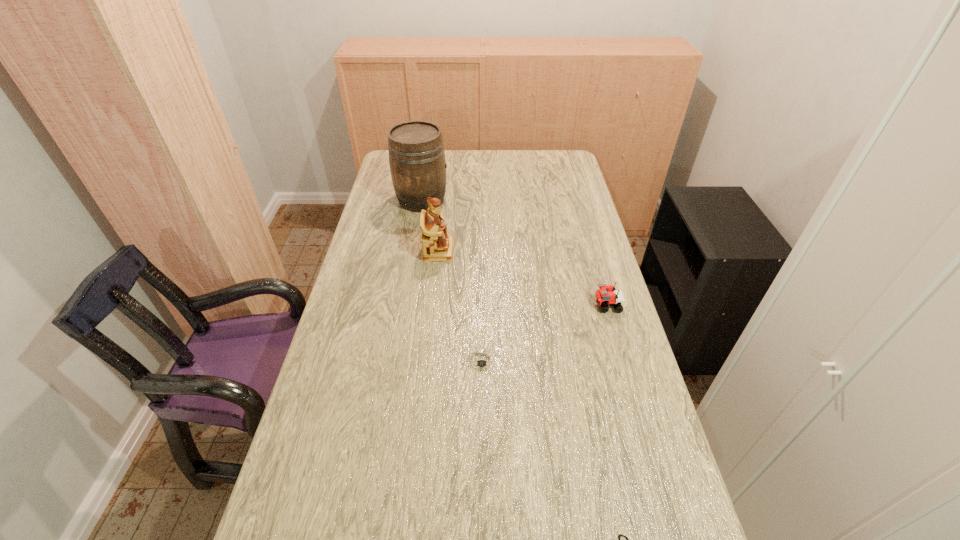
Locate an element on the screen. vacant area situated on the front-facing side of the third tallest object is located at coordinates (521, 306).

At what (x,y) coordinates should I click in order to perform the action: click on vacant space positioned on the front-facing side of the third tallest object. Please return your answer as a coordinate pair (x, y). The image size is (960, 540). Looking at the image, I should click on [521, 306].

You are a GUI agent. You are given a task and a screenshot of the screen. Output one action in this format:
    pyautogui.click(x=<x>, y=<y>)
    Task: Click on the vacant space located 0.250m on the front-facing side of the third tallest object
    The height and width of the screenshot is (540, 960).
    Given the screenshot: What is the action you would take?
    pyautogui.click(x=511, y=306)

The height and width of the screenshot is (540, 960). What are the coordinates of `vacant point located 0.100m on the face of the watch` in the screenshot? It's located at (483, 411).

At what (x,y) coordinates should I click in order to perform the action: click on object that is positioned at the left edge. Please return your answer as a coordinate pair (x, y). Looking at the image, I should click on (416, 153).

Where is `object present at the right edge`? This screenshot has width=960, height=540. object present at the right edge is located at coordinates (606, 295).

This screenshot has width=960, height=540. In order to click on vacant position at the far edge of the desktop in this screenshot , I will do `click(480, 151)`.

Identify the location of vacant space at the left edge. (373, 418).

Image resolution: width=960 pixels, height=540 pixels. Find the location of `vacant area at the right edge`. vacant area at the right edge is located at coordinates (667, 496).

The image size is (960, 540). Find the location of `vacant area between the tallest object and the third farthest object`. vacant area between the tallest object and the third farthest object is located at coordinates (515, 253).